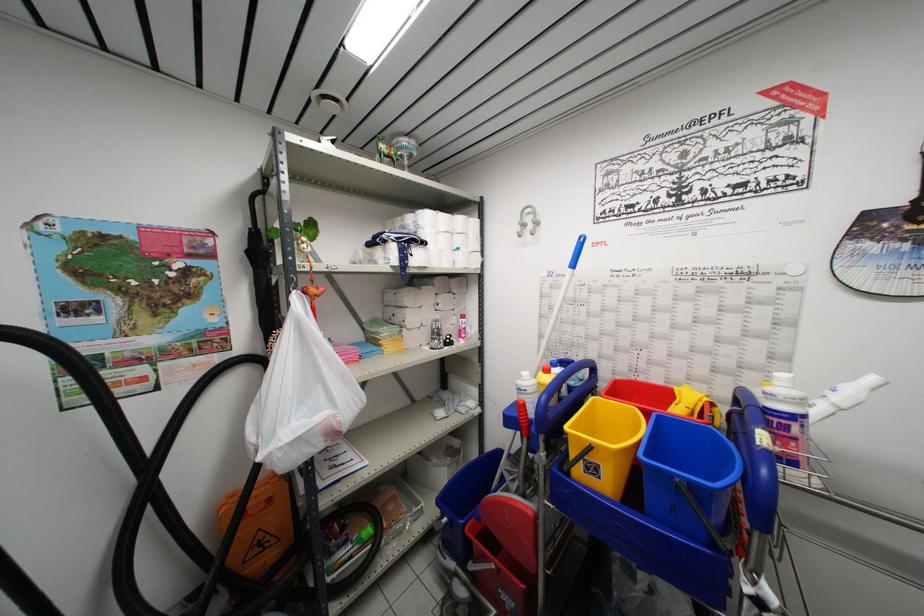
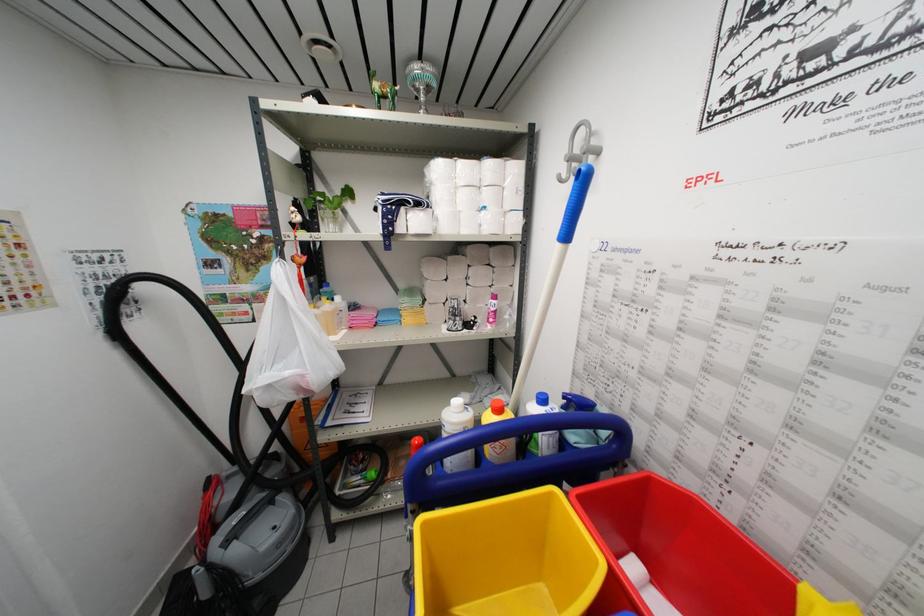
Where in the second image is the point corresponding to the point at 426,292 from the first image?

(453, 262)